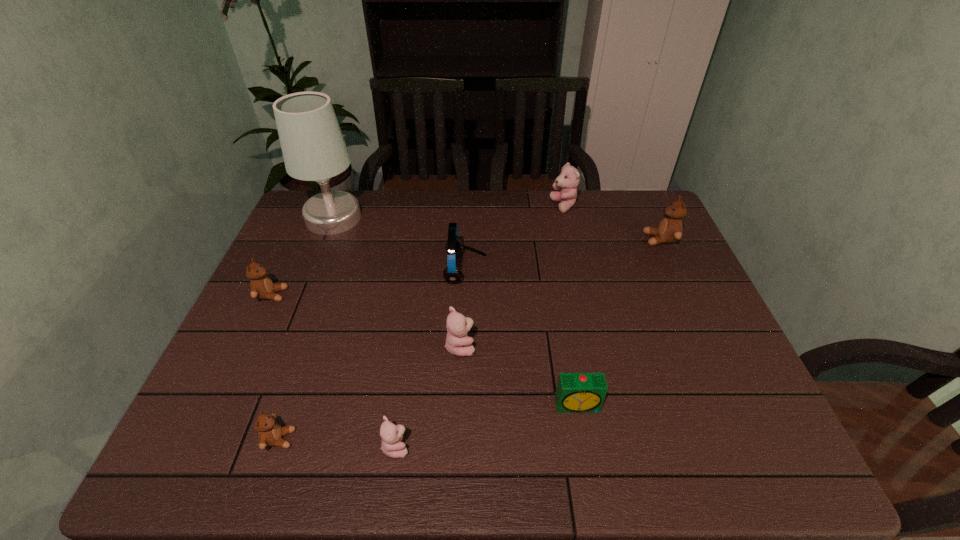
This screenshot has width=960, height=540. I want to click on free spot between the fourth farthest teddy bear and the sixth object from right to left, so click(x=428, y=396).

Locate an element on the screen. The width and height of the screenshot is (960, 540). vacant region between the rightmost object and the second biggest brown teddy bear is located at coordinates (466, 267).

The height and width of the screenshot is (540, 960). Find the location of `free space between the fifth nearest teddy bear and the third nearest teddy bear`. free space between the fifth nearest teddy bear and the third nearest teddy bear is located at coordinates (561, 293).

What are the coordinates of `vacant area that lies between the farthest pink teddy bear and the tallest object` in the screenshot? It's located at (448, 212).

This screenshot has height=540, width=960. In order to click on empty space between the nearest brown teddy bear and the rightmost pink teddy bear in this screenshot , I will do `click(421, 322)`.

Find the location of a particular element. Image resolution: width=960 pixels, height=540 pixels. free space between the rightmost pink teddy bear and the gray lampshade is located at coordinates (448, 212).

Where is `free space between the smallest brown teddy bear and the rightmost pink teddy bear`? free space between the smallest brown teddy bear and the rightmost pink teddy bear is located at coordinates (421, 322).

Where is `vacant area that lies between the tallest object and the second biggest pink teddy bear`? The width and height of the screenshot is (960, 540). vacant area that lies between the tallest object and the second biggest pink teddy bear is located at coordinates (396, 282).

This screenshot has height=540, width=960. I want to click on free space that is in between the fourth teddy bear from right to left and the gray lampshade, so click(x=365, y=332).

Identify the location of object that is the second closest to the biggest pink teddy bear. (454, 246).